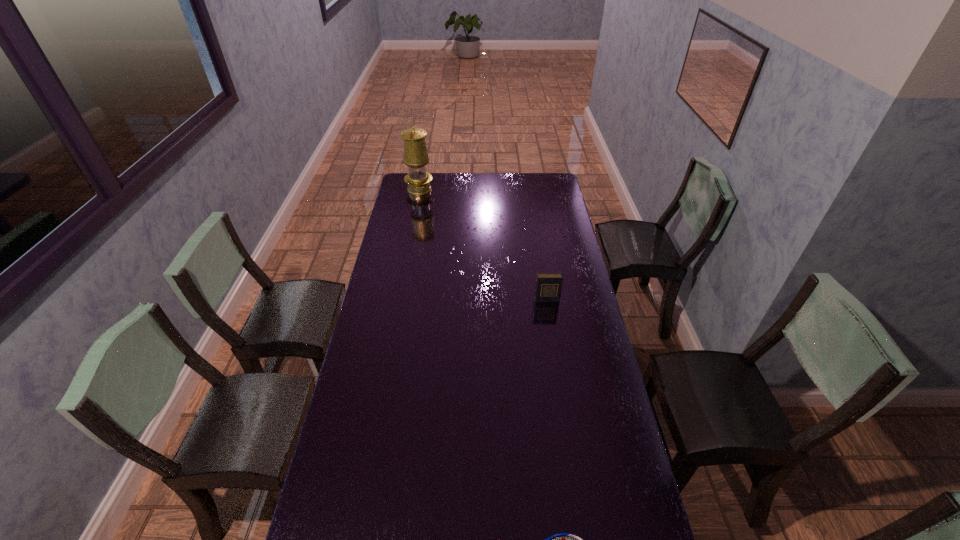
Where is `the tallest object`? the tallest object is located at coordinates (416, 157).

Find the location of a particular element. The width and height of the screenshot is (960, 540). oil lamp is located at coordinates (416, 157).

Locate an element on the screen. This screenshot has width=960, height=540. diary is located at coordinates (548, 288).

You are a GUI agent. You are given a task and a screenshot of the screen. Output one action in this format:
    pyautogui.click(x=<x>, y=<y>)
    Task: Click on the second tallest object
    This screenshot has height=540, width=960.
    Given the screenshot: What is the action you would take?
    pyautogui.click(x=548, y=288)

Find the location of a particular element. This screenshot has width=960, height=540. vacant area located 0.130m on the right of the leftmost object is located at coordinates (457, 189).

Where is `free region located on the front cover of the diary`? The height and width of the screenshot is (540, 960). free region located on the front cover of the diary is located at coordinates (552, 335).

In order to click on object present at the far edge in this screenshot , I will do `click(416, 157)`.

Where is `object that is at the left edge`? object that is at the left edge is located at coordinates (416, 157).

Identify the location of object that is at the right edge. This screenshot has width=960, height=540. [548, 288].

Identify the location of object that is at the far left corner. This screenshot has width=960, height=540. (416, 157).